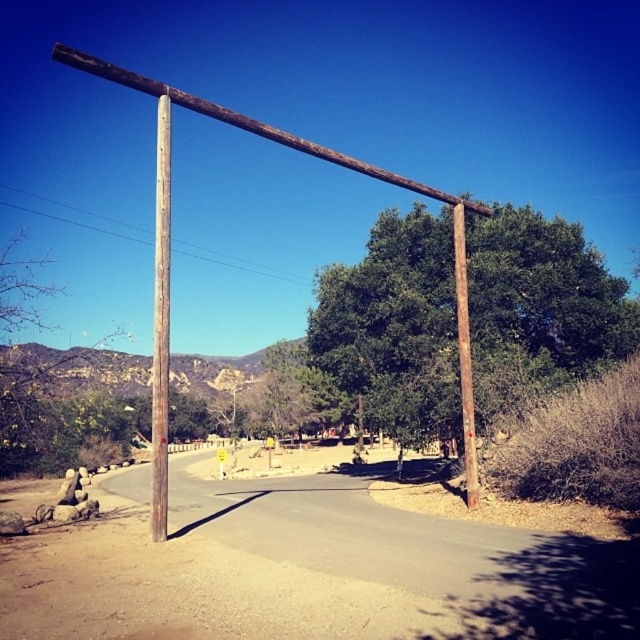
You are standing at the entrance of the road and want to identify the taller pole between the brown rough wooden pole at upper center and the brown rough wooden pole at right. Which one should you look up to see?

The brown rough wooden pole at upper center is taller than the brown rough wooden pole at right, so you should look up to see the brown rough wooden pole at upper center.

You are standing at the entrance of the road and want to walk towards the brown rough wooden pole at upper center and the brown wooden pole at left. Which pole will you reach first?

You will reach the brown rough wooden pole at upper center first because it is closer to you than the brown wooden pole at left, which is further away.

Based on the photo, you are standing at the entrance of the paved road and see two points marked on the rustic wooden gate structure. The first point is at coordinates point (160, 358) and the second point is at point (454, 205). Which point is nearer to you?

Point (160, 358) is closer to the viewer than point (454, 205).